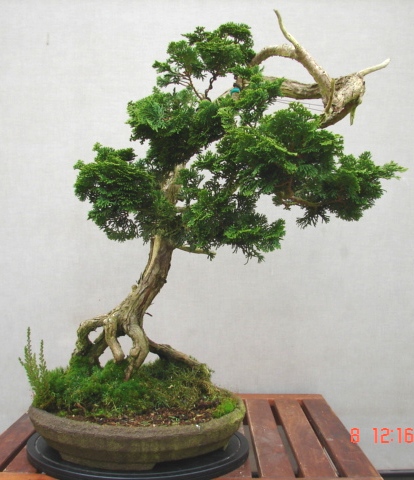
You are a GUI agent. You are given a task and a screenshot of the screen. Output one action in this format:
    pyautogui.click(x=<x>, y=<y>)
    Task: Click on the floor
    Image resolution: width=414 pixels, height=480 pixels.
    Given the screenshot: What is the action you would take?
    pyautogui.click(x=407, y=478)